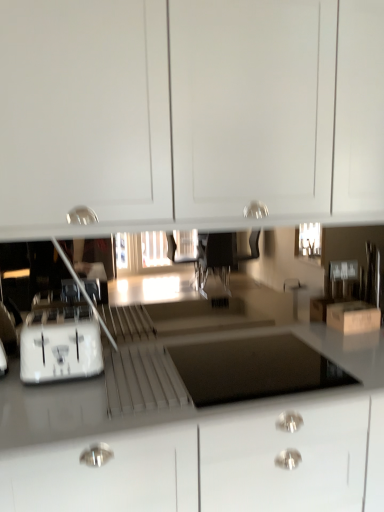
Question: From a real-world perspective, relative to white glossy cabinet at upper center, is white plastic drawer at center vertically above or below?

Choices:
 (A) below
 (B) above

Answer: (A)

Question: Considering the relative positions of white plastic drawer at center and white glossy cabinet at upper center in the image provided, is white plastic drawer at center to the left or to the right of white glossy cabinet at upper center?

Choices:
 (A) left
 (B) right

Answer: (A)

Question: Considering the real-world distances, which object is farthest from the white plastic drawer at center?

Choices:
 (A) brown cardboard box at lower right
 (B) white glossy countertop at lower center
 (C) white plastic toaster at lower left
 (D) white glossy cabinet at upper center

Answer: (D)

Question: Estimate the real-world distances between objects in this image. Which object is closer to the white glossy cabinet at upper center?

Choices:
 (A) brown cardboard box at lower right
 (B) white glossy countertop at lower center
 (C) white plastic toaster at lower left
 (D) white plastic drawer at center

Answer: (C)